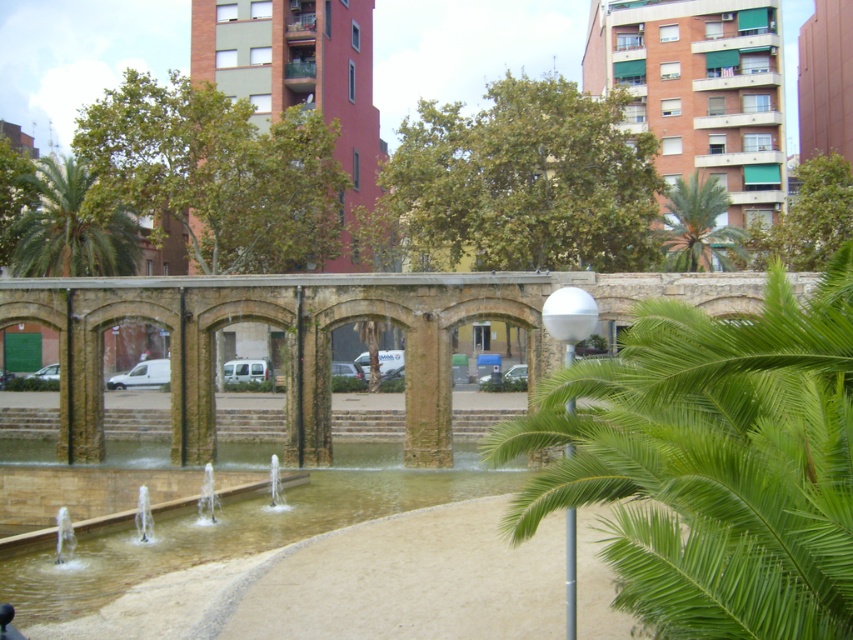
You are standing at the entrance of the park and want to find the clear water at center. According to the coordinates provided, in which direction should you walk from your current position to reach it?

The clear water at center is located at point coordinates, so you should walk towards the center of the park from the entrance to reach it.

You are a landscape architect designing a new park layout. You need to place a new statue exactly halfway between the green leafy palm tree at center and the green leafy palm tree at upper right. Which palm tree will the statue be closer to?

The statue will be closer to the green leafy palm tree at center because it is smaller and therefore positioned closer to the center of the scene compared to the larger palm tree at upper right.

You are a visitor in the park and want to take a photo of both the green leafy palm tree at center and the green leafy palm tree at upper right. Which palm tree should you stand closer to in order to capture both in the same frame?

Since the green leafy palm tree at center is shorter than the green leafy palm tree at upper right, you should stand closer to the green leafy palm tree at center to ensure both are visible in the frame.